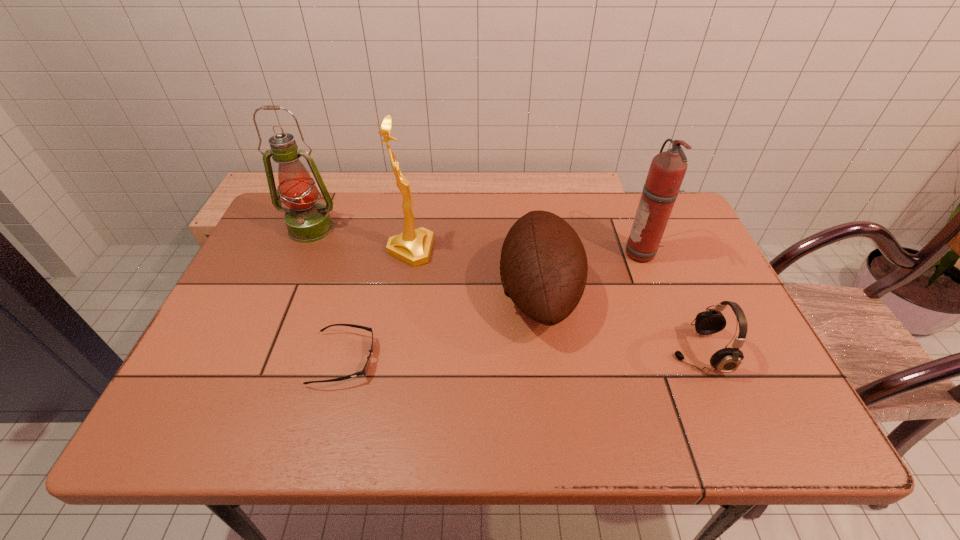
You are a GUI agent. You are given a task and a screenshot of the screen. Output one action in this format:
    pyautogui.click(x=<x>, y=<y>)
    Task: Click on the award
    
    Given the screenshot: What is the action you would take?
    tap(413, 246)

The width and height of the screenshot is (960, 540). In order to click on the leftmost object in this screenshot , I will do `click(307, 221)`.

In order to click on fire extinguisher in this screenshot , I will do `click(667, 170)`.

Image resolution: width=960 pixels, height=540 pixels. In order to click on football in this screenshot , I will do `click(543, 267)`.

The width and height of the screenshot is (960, 540). What are the coordinates of `the fourth tallest object` in the screenshot? It's located at pos(543,267).

The height and width of the screenshot is (540, 960). In order to click on the second shortest object in this screenshot , I will do `click(727, 360)`.

Identify the location of the shortest object. Image resolution: width=960 pixels, height=540 pixels. coord(364,372).

Identify the location of free point located 0.140m on the front-facing side of the award. (483, 250).

Identify the location of vacant space situated 0.100m on the right of the leftmost object. This screenshot has height=540, width=960. (374, 228).

Where is `vacant space located 0.140m on the side of the fire extinguisher with the label and nozzle`? This screenshot has width=960, height=540. vacant space located 0.140m on the side of the fire extinguisher with the label and nozzle is located at coordinates (575, 254).